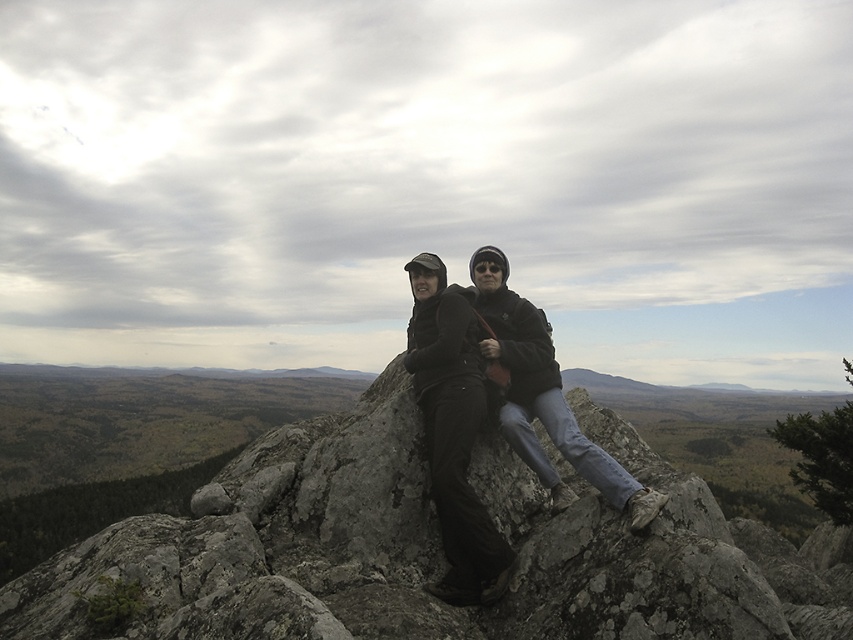
You are planning to place a small flag on the highest point between the gray rock at center and the matte black jacket at center. According to the scene, which object should the flag be placed on?

The flag should be placed on the matte black jacket at center because the gray rock at center is below it, meaning the jacket is higher.